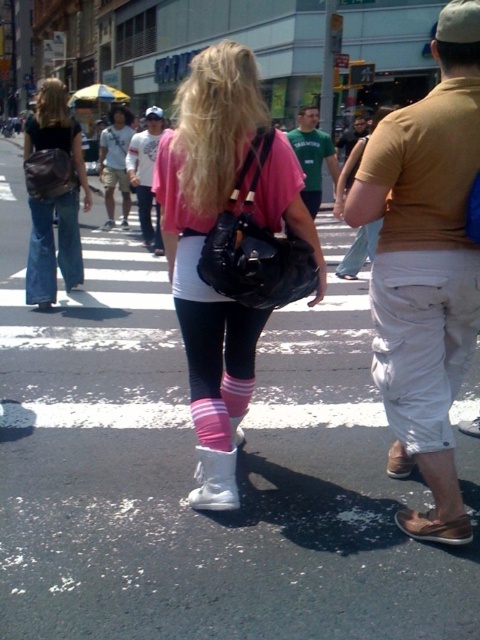
Does pink matte leggings at center lie in front of pink striped sock at lower center?

Yes.

I want to click on pink matte leggings at center, so click(x=230, y=218).

Who is more distant from viewer, (412, 300) or (218, 436)?

The point (218, 436) is more distant.

Identify the location of white cotton shorts at lower right. (422, 339).

The image size is (480, 640). What do you see at coordinates (422, 339) in the screenshot?
I see `white cotton shorts at lower right` at bounding box center [422, 339].

Locate an element on the screen. Image resolution: width=480 pixels, height=640 pixels. white cotton shorts at lower right is located at coordinates (422, 339).

From the picture: Which is below, matte yellow t-shirt at center or pink fabric sock at center?

Positioned lower is pink fabric sock at center.

Does matte yellow t-shirt at center come behind pink fabric sock at center?

No.

At what (x,y) coordinates should I click in order to perform the action: click on matte yellow t-shirt at center. Please return your answer as a coordinate pair (x, y). This screenshot has height=640, width=480. Looking at the image, I should click on (425, 268).